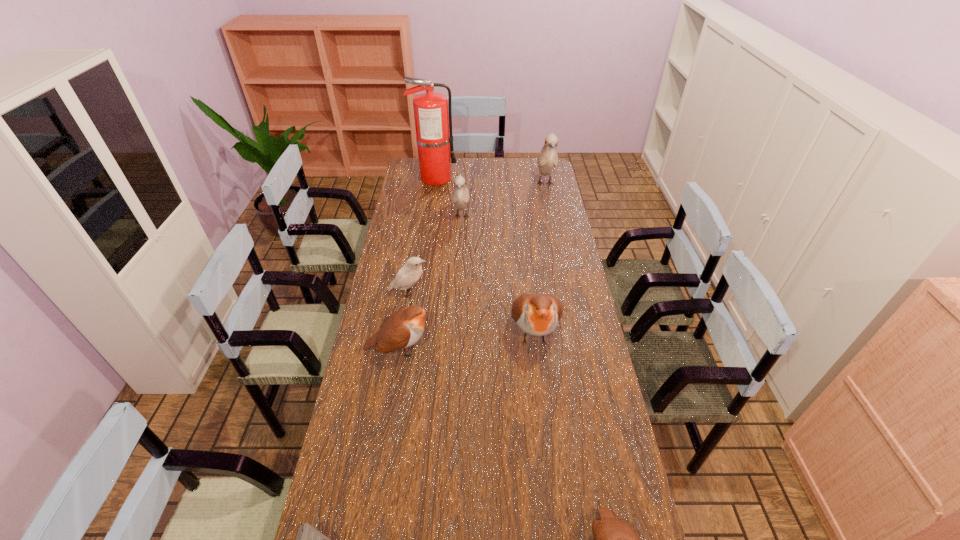
The height and width of the screenshot is (540, 960). In order to click on object at the far right corner in this screenshot , I will do `click(547, 159)`.

This screenshot has width=960, height=540. In the image, there is a desktop. What are the coordinates of `free space at the far edge` in the screenshot? It's located at 521,167.

Locate an element on the screen. The image size is (960, 540). free space at the left edge of the desktop is located at coordinates (390, 404).

At what (x,y) coordinates should I click in order to perform the action: click on blank space at the right edge of the desktop. Please return your answer as a coordinate pair (x, y). Looking at the image, I should click on (554, 281).

You are a GUI agent. You are given a task and a screenshot of the screen. Output one action in this format:
    pyautogui.click(x=<x>, y=<y>)
    Task: Click on the vacant space at the far right corner of the desktop
    
    Given the screenshot: What is the action you would take?
    pyautogui.click(x=543, y=179)

Find the location of a particular element. This screenshot has width=960, height=540. vacant region between the biggest brown bird and the farthest bird is located at coordinates (539, 258).

Locate an element on the screen. Image resolution: width=960 pixels, height=540 pixels. free space between the nearest white bird and the second smallest white bird is located at coordinates point(436,255).

At what (x,y) coordinates should I click in order to perform the action: click on object that is the closest to the leftmost brown bird. Please return your answer as a coordinate pair (x, y). This screenshot has width=960, height=540. Looking at the image, I should click on (410, 273).

Locate which object ranks fourth in proximity to the farthest bird. Please provide its 2D coordinates. Your answer should be formatted as a tuple, i.e. [(x, y)], where the tuple contains the x and y coordinates of a point satisfying the conditions above.

[(410, 273)]

Identify which bird is the third closest to the shortest bird. Please provide its 2D coordinates. Your answer should be formatted as a tuple, i.e. [(x, y)], where the tuple contains the x and y coordinates of a point satisfying the conditions above.

[(410, 273)]